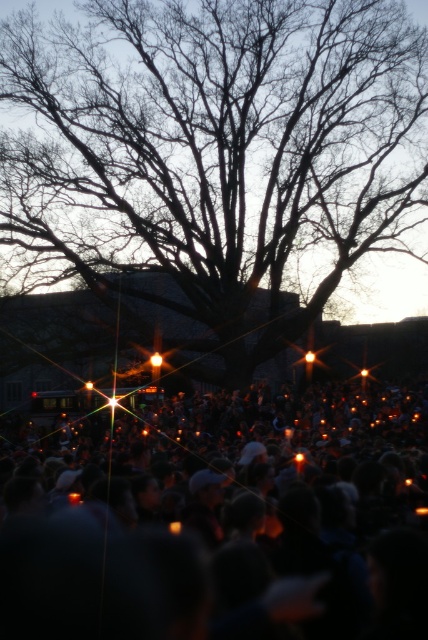
You are a photographer trying to capture the silhouette bare branches at center and the orange candle at lower center in the same frame. Given that your camera has a maximum focal length of 50 meters, will you be able to include both objects in your shot?

The silhouette bare branches at center and orange candle at lower center are 32.88 meters apart. Since the maximum focal length is 50 meters, the distance between them is within the camera range, so yes, both objects can be captured in the same frame.

You are a photographer aiming to capture the orange candle at lower center without the silhouette bare branches at center blocking it. Based on their sizes, is this possible?

The silhouette bare branches at center is bigger than the orange candle at lower center, so it might block the candle if positioned directly in front. Adjust your angle to frame around the branches to ensure the candle is visible.

You are part of the crowd holding a candle and want to move towards the center of the gathering. The silhouette of the bare branches is at the center. Can you walk straight from your current position at point (x=213, y=148) to the center without obstacles?

The point (x=213, y=148) is already at the center where the silhouette of the bare branches is located, so you are already at the center.